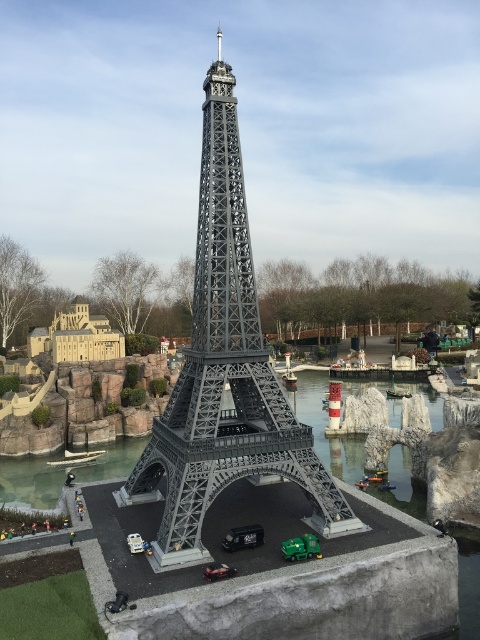
Question: Among these objects, which one is farthest from the camera?

Choices:
 (A) green plastic car at center
 (B) metallic gray eiffel tower at center

Answer: (B)

Question: Does metallic gray eiffel tower at center appear on the right side of green plastic car at center?

Choices:
 (A) no
 (B) yes

Answer: (A)

Question: Is the position of metallic gray eiffel tower at center more distant than that of green plastic car at center?

Choices:
 (A) no
 (B) yes

Answer: (B)

Question: Is metallic gray eiffel tower at center below green plastic car at center?

Choices:
 (A) yes
 (B) no

Answer: (B)